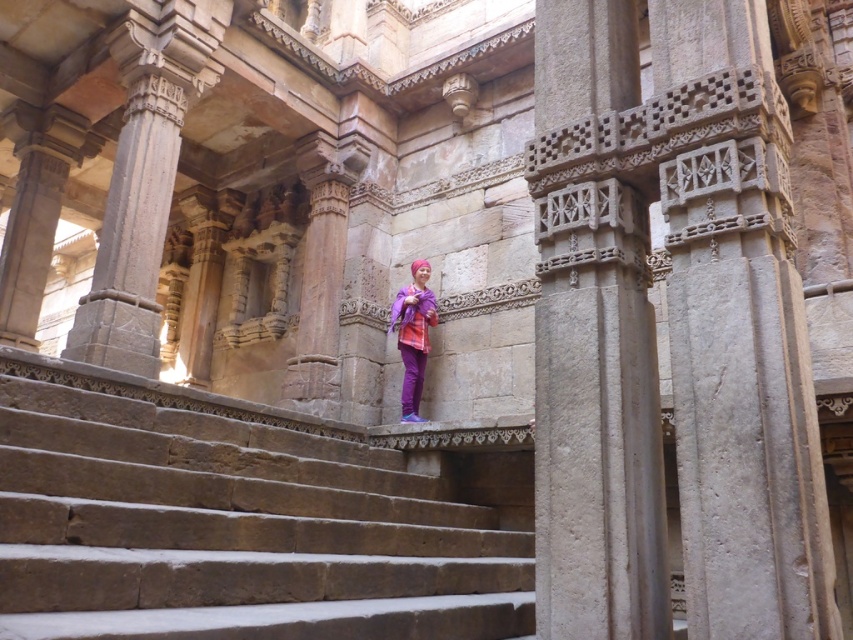
Question: Which object is the farthest from the purple matte sweatshirt at center?

Choices:
 (A) brown stone stairs at center
 (B) purple fabric at center

Answer: (A)

Question: Observing the image, what is the correct spatial positioning of brown stone stairs at center in reference to purple matte sweatshirt at center?

Choices:
 (A) left
 (B) right

Answer: (A)

Question: Among these objects, which one is nearest to the camera?

Choices:
 (A) purple fabric at center
 (B) brown stone stairs at center
 (C) purple matte sweatshirt at center

Answer: (B)

Question: Is the position of brown stone stairs at center more distant than that of purple fabric at center?

Choices:
 (A) no
 (B) yes

Answer: (A)

Question: Among these points, which one is nearest to the camera?

Choices:
 (A) [181, 618]
 (B) [416, 326]

Answer: (A)

Question: Does brown stone stairs at center appear under purple matte sweatshirt at center?

Choices:
 (A) no
 (B) yes

Answer: (B)